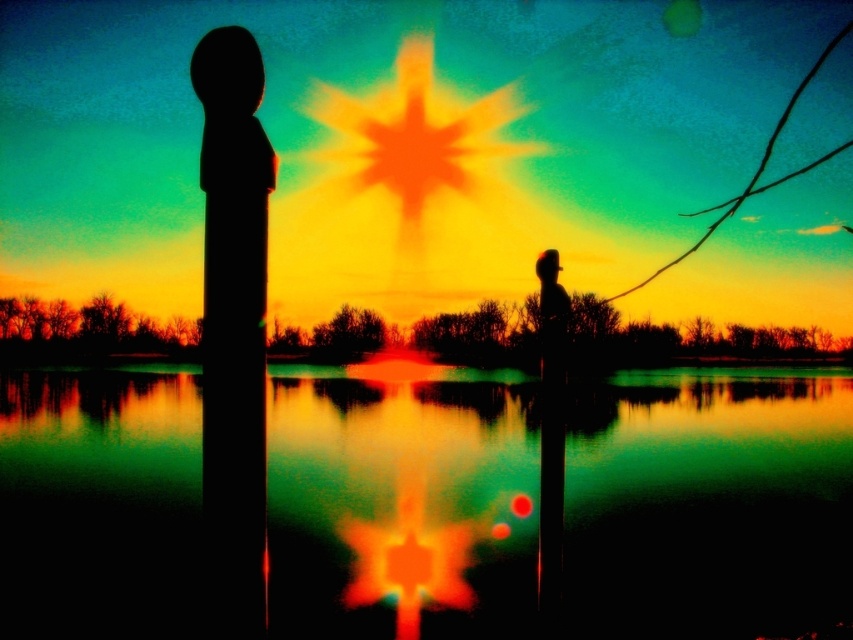
Does green reflective water at center have a lesser width compared to black matte pillar at left?

No, green reflective water at center is not thinner than black matte pillar at left.

Is point (735, 371) positioned behind point (207, 320)?

Yes, it is.

Is point (677, 564) more distant than point (254, 64)?

Yes, it is behind point (254, 64).

Where is `green reflective water at center`? The height and width of the screenshot is (640, 853). green reflective water at center is located at coordinates (706, 502).